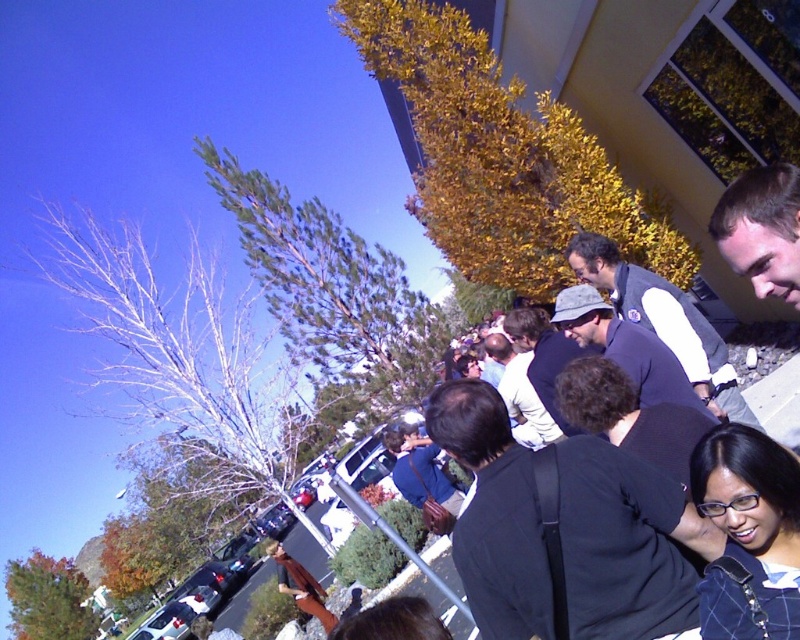
Consider the image. You are a photographer setting up equipment in the center of the scene. You notice the black matte jacket at center and the matte black hat at center. Which object should you move to ensure they don not block the camera lens?

The black matte jacket at center is smaller than the matte black hat at center, so you should move the matte black hat at center to avoid blocking the camera lens since it is larger.

You are a photographer standing in the scene and want to take a photo of the matte black hat at center and the dark blue shirt at center. Which object will appear larger in the photo?

The matte black hat at center will appear larger in the photo because it is closer to the viewer than the dark blue shirt at center.

You are standing in the center of the scene and see the point at coordinates (626, 544). Which object is this point located on?

The point at coordinates (626, 544) is located on the black matte jacket at center.